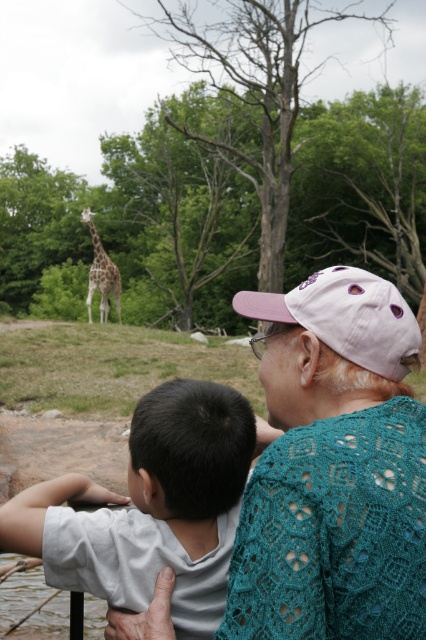
Question: Can you confirm if white matte shirt at upper left is bigger than pink fabric baseball cap at center?

Choices:
 (A) no
 (B) yes

Answer: (B)

Question: Is white matte shirt at upper left closer to camera compared to spotted fur giraffe at upper left?

Choices:
 (A) yes
 (B) no

Answer: (A)

Question: Which object is farther from the camera taking this photo?

Choices:
 (A) spotted fur giraffe at upper left
 (B) white matte shirt at upper left

Answer: (A)

Question: Which of these objects is positioned farthest from the pink fabric baseball cap at center?

Choices:
 (A) spotted fur giraffe at upper left
 (B) white matte shirt at upper left

Answer: (A)

Question: Estimate the real-world distances between objects in this image. Which object is farther from the white matte shirt at upper left?

Choices:
 (A) pink fabric baseball cap at center
 (B) spotted fur giraffe at upper left

Answer: (B)

Question: Is pink fabric baseball cap at center thinner than spotted fur giraffe at upper left?

Choices:
 (A) yes
 (B) no

Answer: (A)